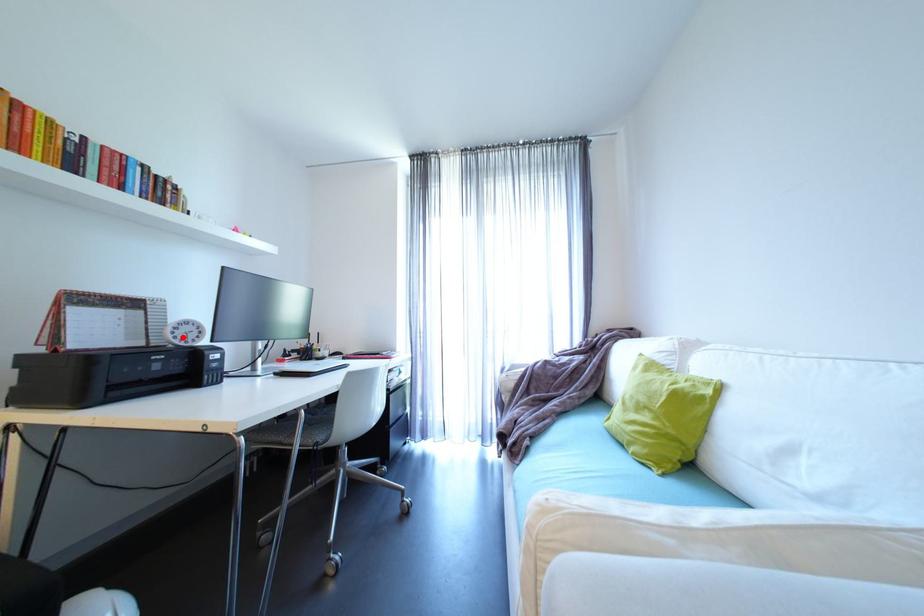
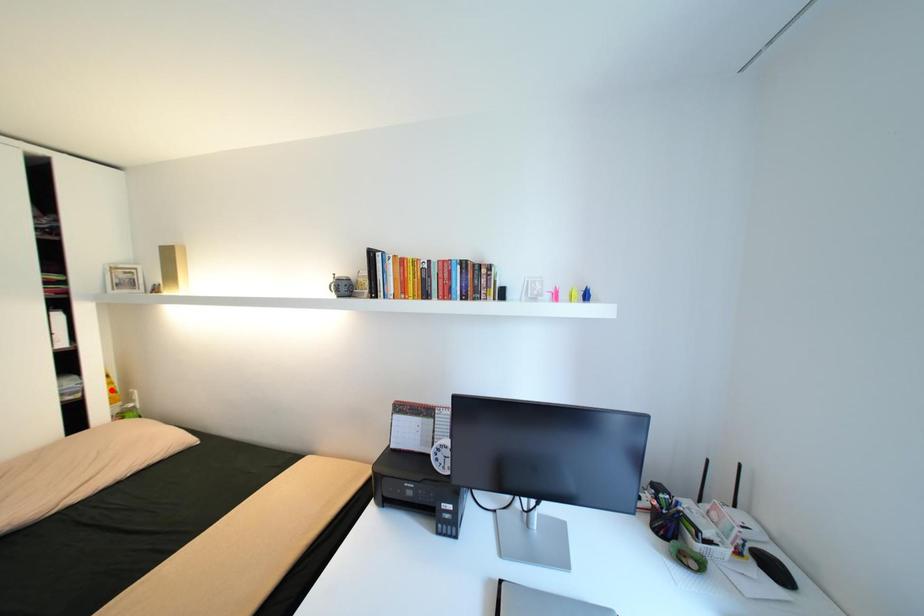
I am providing you with two images of the same scene from different viewpoints. A red point is marked on the first image and another point is marked on the second image. Are the points marked in image1 and image2 representing the same 3D position?

No